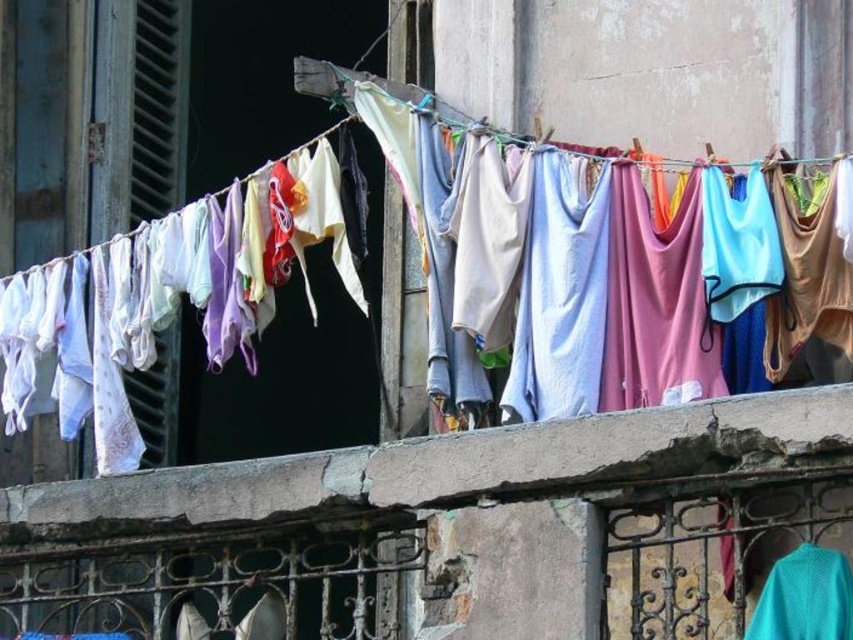
You are standing on the balcony and want to place a small potted plant on the concrete at center. Considering the height of the white cotton towel at center, will the towel obscure the view of the potted plant from below?

The concrete at center is not as tall as the white cotton towel at center, so the towel is taller. This means the towel would likely block the view of the potted plant placed on the concrete from below.

You are standing on the balcony and want to place a new plant pot on the concrete at center. However, there is a white cotton towel at center currently occupying that spot. Which object should you move to make space?

The white cotton towel at center is behind the concrete at center, so you should move the white cotton towel at center to make space for the plant pot.